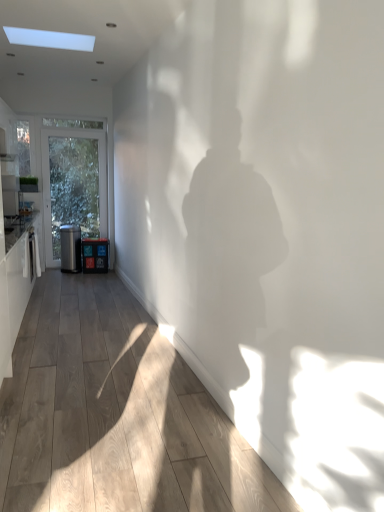
The height and width of the screenshot is (512, 384). What do you see at coordinates (15, 286) in the screenshot?
I see `white glossy cabinetry at left` at bounding box center [15, 286].

In the scene shown: What is the approximate height of satin black trash can at left, the first appliance viewed from the left?

The height of satin black trash can at left, the first appliance viewed from the left, is 27.04 inches.

This screenshot has height=512, width=384. Identify the location of satin black trash can at left, the first appliance viewed from the left. (70, 248).

Image resolution: width=384 pixels, height=512 pixels. Describe the element at coordinates (95, 255) in the screenshot. I see `matte black trash can at left, which ranks as the 1th appliance in right-to-left order` at that location.

Measure the distance between point [206,453] and camera.

The depth of point [206,453] is 2.18 meters.

Where is `white glossy cabinetry at left`? The height and width of the screenshot is (512, 384). white glossy cabinetry at left is located at coordinates (15, 286).

Is wooden floor at center turned away from white glossy cabinetry at left?

Yes, white glossy cabinetry at left is at the back of wooden floor at center.

Considering the relative sizes of wooden floor at center and white glossy cabinetry at left in the image provided, is wooden floor at center smaller than white glossy cabinetry at left?

Indeed, wooden floor at center has a smaller size compared to white glossy cabinetry at left.

Looking at this image, relative to white glossy cabinetry at left, is wooden floor at center in front or behind?

Clearly, wooden floor at center is in front of white glossy cabinetry at left.

You are a GUI agent. You are given a task and a screenshot of the screen. Output one action in this format:
    pyautogui.click(x=<x>, y=<y>)
    Task: Click on the cabinetry above the wooden floor at center (from the image's perspective)
    This screenshot has height=512, width=384.
    Given the screenshot: What is the action you would take?
    pyautogui.click(x=15, y=286)

From a real-world perspective, who is located lower, white glossy cabinetry at left or satin black trash can at left, the first appliance viewed from the left?

In real-world perspective, satin black trash can at left, the first appliance viewed from the left, is lower.

Is point (25, 278) positioned before point (71, 257)?

That is True.

Is white glossy cabinetry at left directly adjacent to satin black trash can at left, the first appliance viewed from the left?

white glossy cabinetry at left is not next to satin black trash can at left, the first appliance viewed from the left, and they're not touching.

Considering the sizes of objects satin black trash can at left, which is the second appliance in right-to-left order, and matte black trash can at left, which ranks as the 1th appliance in right-to-left order, in the image provided, who is bigger, satin black trash can at left, which is the second appliance in right-to-left order, or matte black trash can at left, which ranks as the 1th appliance in right-to-left order,?

satin black trash can at left, which is the second appliance in right-to-left order, is bigger.

Between satin black trash can at left, which is the second appliance in right-to-left order, and matte black trash can at left, positioned as the 2th appliance in left-to-right order, which one has more height?

satin black trash can at left, which is the second appliance in right-to-left order, is taller.

Based on the photo, from the image's perspective, is satin black trash can at left, which is the second appliance in right-to-left order, below matte black trash can at left, positioned as the 2th appliance in left-to-right order?

No.

Is satin black trash can at left, which is the second appliance in right-to-left order, in contact with matte black trash can at left, positioned as the 2th appliance in left-to-right order?

There is a gap between satin black trash can at left, which is the second appliance in right-to-left order, and matte black trash can at left, positioned as the 2th appliance in left-to-right order.

From the wooden floor at center, count the 2nd appliance to the left and point to it. Please provide its 2D coordinates.

[(70, 248)]

Is point (78, 271) positioned in front of point (177, 445)?

No, (78, 271) is further to viewer.

How far apart are satin black trash can at left, the first appliance viewed from the left, and wooden floor at center?

satin black trash can at left, the first appliance viewed from the left, is 2.81 meters away from wooden floor at center.

Between satin black trash can at left, the first appliance viewed from the left, and wooden floor at center, which one appears on the left side from the viewer's perspective?

From the viewer's perspective, satin black trash can at left, the first appliance viewed from the left, appears more on the left side.

How many degrees apart are the facing directions of matte black trash can at left, which ranks as the 1th appliance in right-to-left order, and wooden floor at center?

There is a 94.4-degree angle between the facing directions of matte black trash can at left, which ranks as the 1th appliance in right-to-left order, and wooden floor at center.

Considering the relative sizes of matte black trash can at left, which ranks as the 1th appliance in right-to-left order, and wooden floor at center in the image provided, is matte black trash can at left, which ranks as the 1th appliance in right-to-left order, bigger than wooden floor at center?

No, matte black trash can at left, which ranks as the 1th appliance in right-to-left order, is not bigger than wooden floor at center.

Is matte black trash can at left, which ranks as the 1th appliance in right-to-left order, to the left or to the right of wooden floor at center in the image?

matte black trash can at left, which ranks as the 1th appliance in right-to-left order, is positioned on wooden floor at center's left side.

From the image's perspective, is matte black trash can at left, which ranks as the 1th appliance in right-to-left order, positioned above or below wooden floor at center?

matte black trash can at left, which ranks as the 1th appliance in right-to-left order, is above wooden floor at center.

Between wooden floor at center and matte black trash can at left, positioned as the 2th appliance in left-to-right order, which one appears on the right side from the viewer's perspective?

wooden floor at center is more to the right.

Considering the relative sizes of wooden floor at center and matte black trash can at left, positioned as the 2th appliance in left-to-right order, in the image provided, is wooden floor at center smaller than matte black trash can at left, positioned as the 2th appliance in left-to-right order,?

Incorrect, wooden floor at center is not smaller in size than matte black trash can at left, positioned as the 2th appliance in left-to-right order.

Considering the sizes of wooden floor at center and matte black trash can at left, positioned as the 2th appliance in left-to-right order, in the image, is wooden floor at center taller or shorter than matte black trash can at left, positioned as the 2th appliance in left-to-right order,?

In the image, wooden floor at center appears to be shorter than matte black trash can at left, positioned as the 2th appliance in left-to-right order.

Where is `cabinetry above the wooden floor at center (from a real-world perspective)`? This screenshot has height=512, width=384. cabinetry above the wooden floor at center (from a real-world perspective) is located at coordinates (15, 286).

From the image's perspective, between white glossy cabinetry at left and wooden floor at center, who is located below?

wooden floor at center appears lower in the image.

Between white glossy cabinetry at left and wooden floor at center, which one has less height?

wooden floor at center is shorter.

Where is `corridor located on the right of white glossy cabinetry at left`? corridor located on the right of white glossy cabinetry at left is located at coordinates (116, 415).

The image size is (384, 512). What are the coordinates of `the 1st appliance located beneath the white glossy cabinetry at left (from a real-world perspective)` in the screenshot? It's located at (70, 248).

In the scene shown: Based on their spatial positions, is matte black trash can at left, which ranks as the 1th appliance in right-to-left order, or wooden floor at center further from satin black trash can at left, which is the second appliance in right-to-left order?

Among the two, wooden floor at center is located further to satin black trash can at left, which is the second appliance in right-to-left order.

From the image, which object appears to be nearer to matte black trash can at left, which ranks as the 1th appliance in right-to-left order, white glossy cabinetry at left or satin black trash can at left, the first appliance viewed from the left?

The object closer to matte black trash can at left, which ranks as the 1th appliance in right-to-left order, is satin black trash can at left, the first appliance viewed from the left.

From the image, which object appears to be nearer to matte black trash can at left, which ranks as the 1th appliance in right-to-left order, wooden floor at center or satin black trash can at left, which is the second appliance in right-to-left order?

Among the two, satin black trash can at left, which is the second appliance in right-to-left order, is located nearer to matte black trash can at left, which ranks as the 1th appliance in right-to-left order.

From the image, which object appears to be farther from wooden floor at center, matte black trash can at left, which ranks as the 1th appliance in right-to-left order, or white glossy cabinetry at left?

Among the two, matte black trash can at left, which ranks as the 1th appliance in right-to-left order, is located further to wooden floor at center.

Based on their spatial positions, is satin black trash can at left, the first appliance viewed from the left, or white glossy cabinetry at left further from wooden floor at center?

satin black trash can at left, the first appliance viewed from the left, is positioned further to the anchor wooden floor at center.

Consider the image. When comparing their distances from satin black trash can at left, which is the second appliance in right-to-left order, does white glossy cabinetry at left or matte black trash can at left, which ranks as the 1th appliance in right-to-left order, seem further?

Based on the image, white glossy cabinetry at left appears to be further to satin black trash can at left, which is the second appliance in right-to-left order.

Based on their spatial positions, is satin black trash can at left, which is the second appliance in right-to-left order, or matte black trash can at left, which ranks as the 1th appliance in right-to-left order, further from wooden floor at center?

The object further to wooden floor at center is satin black trash can at left, which is the second appliance in right-to-left order.

From the image, which object appears to be nearer to white glossy cabinetry at left, matte black trash can at left, which ranks as the 1th appliance in right-to-left order, or satin black trash can at left, which is the second appliance in right-to-left order?

satin black trash can at left, which is the second appliance in right-to-left order, lies closer to white glossy cabinetry at left than the other object.

Identify the location of cabinetry located between wooden floor at center and matte black trash can at left, which ranks as the 1th appliance in right-to-left order, in the depth direction. This screenshot has height=512, width=384. (15, 286).

You are a GUI agent. You are given a task and a screenshot of the screen. Output one action in this format:
    pyautogui.click(x=<x>, y=<y>)
    Task: Click on the cabinetry between wooden floor at center and satin black trash can at left, which is the second appliance in right-to-left order, from front to back
    Image resolution: width=384 pixels, height=512 pixels.
    Given the screenshot: What is the action you would take?
    click(x=15, y=286)

Locate an element on the screen. appliance between wooden floor at center and matte black trash can at left, which ranks as the 1th appliance in right-to-left order, from front to back is located at coordinates (70, 248).

Find the location of a particular element. appliance positioned between white glossy cabinetry at left and matte black trash can at left, positioned as the 2th appliance in left-to-right order, from near to far is located at coordinates (70, 248).